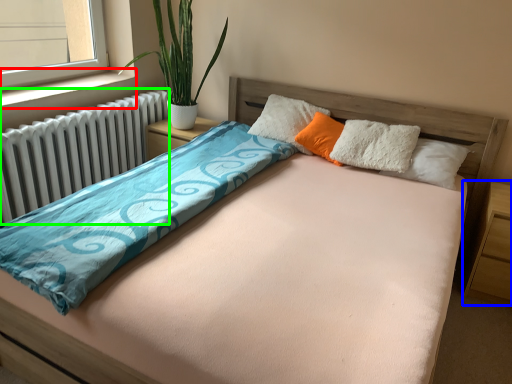
Question: Based on their relative distances, which object is nearer to window sill (highlighted by a red box)? Choose from nightstand (highlighted by a blue box) and radiator (highlighted by a green box).

Choices:
 (A) nightstand
 (B) radiator

Answer: (B)